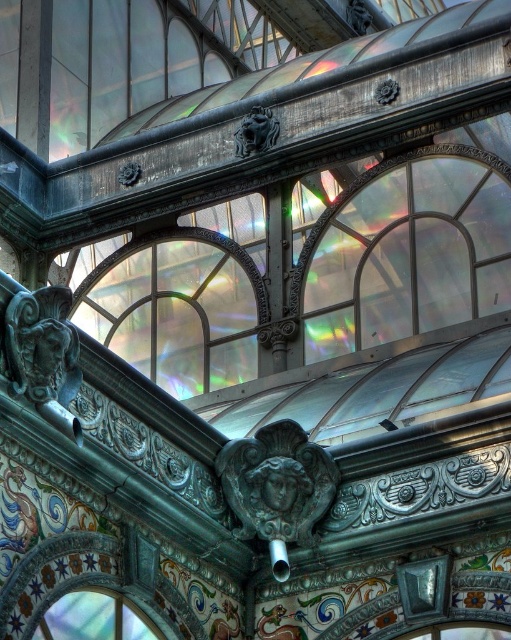
Which is more to the left, transparent iridescent glass at upper center or translucent glass window at lower center?

Positioned to the left is translucent glass window at lower center.

Who is more distant from viewer, (433, 282) or (64, 618)?

The point (433, 282) is more distant.

This screenshot has height=640, width=511. What do you see at coordinates (409, 257) in the screenshot? I see `transparent iridescent glass at upper center` at bounding box center [409, 257].

Locate an element on the screen. Image resolution: width=511 pixels, height=640 pixels. transparent iridescent glass at upper center is located at coordinates (409, 257).

Does transparent iridescent glass at upper center appear under translucent glass window at center?

No.

Is transparent iridescent glass at upper center shorter than translucent glass window at center?

Correct, transparent iridescent glass at upper center is not as tall as translucent glass window at center.

Which is behind, point (342, 353) or point (134, 269)?

The point (134, 269) is behind.

Where is `transparent iridescent glass at upper center`? The height and width of the screenshot is (640, 511). transparent iridescent glass at upper center is located at coordinates (409, 257).

Which is more to the right, translucent glass window at center or translucent glass window at lower center?

translucent glass window at lower center is more to the right.

Between translucent glass window at center and translucent glass window at lower center, which one has less height?

translucent glass window at lower center

Between point (262, 296) and point (114, 621), which one is positioned behind?

Positioned behind is point (262, 296).

You are a GUI agent. You are given a task and a screenshot of the screen. Output one action in this format:
    pyautogui.click(x=<x>, y=<y>)
    Task: Click on the translucent glass window at center
    This screenshot has width=511, height=640.
    Given the screenshot: What is the action you would take?
    pyautogui.click(x=177, y=308)